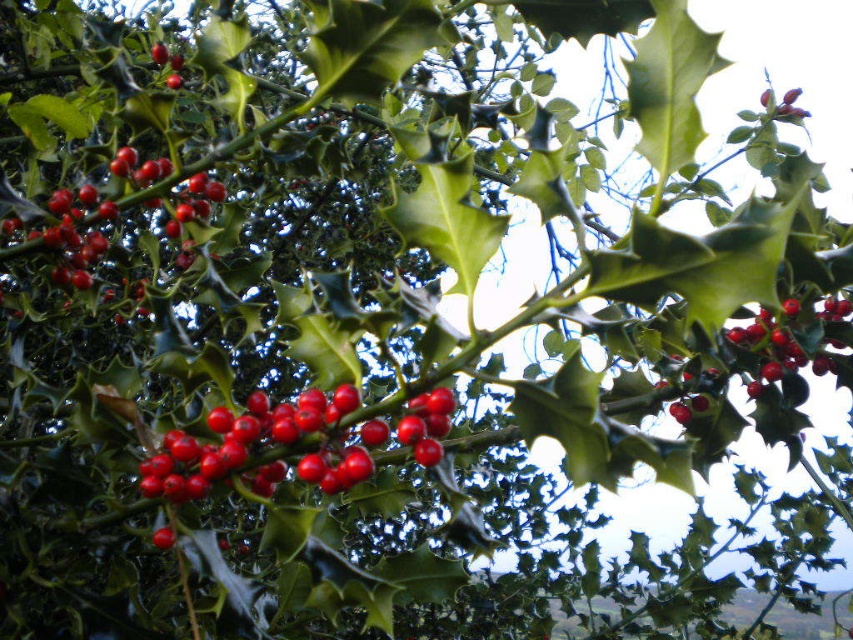
Question: Among these points, which one is farthest from the camera?

Choices:
 (A) (787, 332)
 (B) (77, 280)

Answer: (B)

Question: Does glossy red berries at upper left appear under glossy red berry at center?

Choices:
 (A) yes
 (B) no

Answer: (A)

Question: Can you confirm if glossy red berries at upper right is positioned to the left of glossy red berries at upper left?

Choices:
 (A) no
 (B) yes

Answer: (A)

Question: Among these objects, which one is nearest to the camera?

Choices:
 (A) glossy red berry at center
 (B) glossy red berries at center

Answer: (B)

Question: Can you confirm if glossy red berries at upper right is positioned above glossy red berries at upper left?

Choices:
 (A) yes
 (B) no

Answer: (B)

Question: Which object is farther from the camera taking this photo?

Choices:
 (A) glossy red berry at center
 (B) glossy red berries at center
 (C) glossy red berries at upper left
 (D) glossy red berries at upper right

Answer: (A)